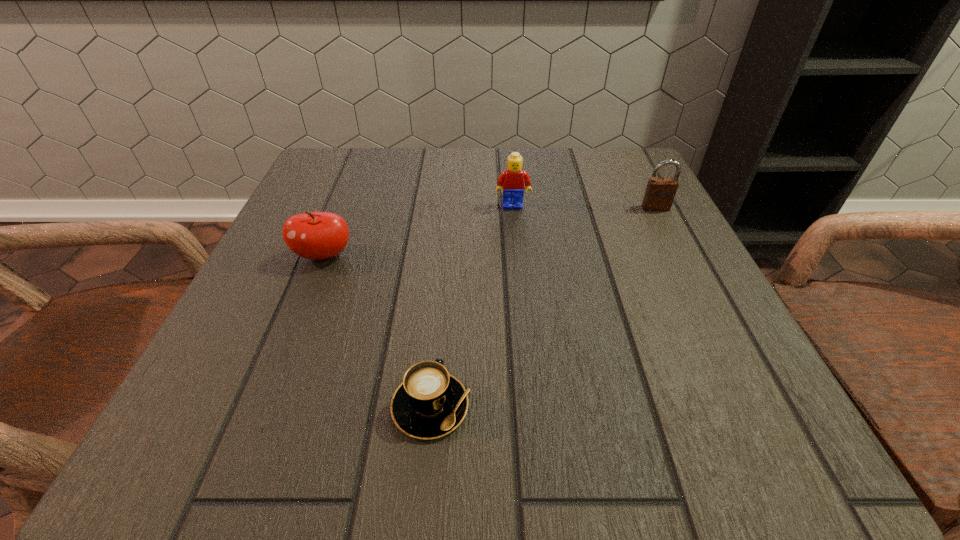
The width and height of the screenshot is (960, 540). What are the coordinates of `object at the far edge` in the screenshot? It's located at (511, 179).

Locate an element on the screen. Image resolution: width=960 pixels, height=540 pixels. object located at the near edge is located at coordinates (430, 403).

This screenshot has width=960, height=540. Identify the location of object that is positioned at the left edge. (311, 235).

The width and height of the screenshot is (960, 540). Find the location of `object that is at the right edge`. object that is at the right edge is located at coordinates pos(659,195).

Where is `free space at the far edge of the desktop`? free space at the far edge of the desktop is located at coordinates (501, 156).

Where is `free point at the near edge`? Image resolution: width=960 pixels, height=540 pixels. free point at the near edge is located at coordinates (580, 449).

Image resolution: width=960 pixels, height=540 pixels. In the image, there is a desktop. Find the location of `vacant space at the left edge`. vacant space at the left edge is located at coordinates (265, 274).

Locate an element on the screen. The image size is (960, 540). vacant space at the right edge of the desktop is located at coordinates (770, 392).

In order to click on vacant point at the far left corner in this screenshot , I will do [x=301, y=185].

Where is `vacant space at the far right corner of the desktop`? Image resolution: width=960 pixels, height=540 pixels. vacant space at the far right corner of the desktop is located at coordinates (582, 158).